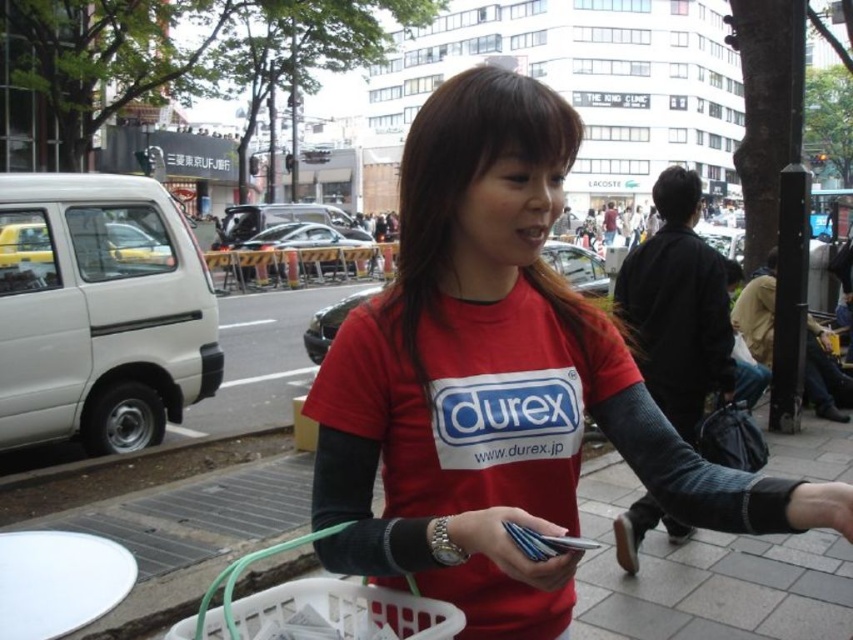
Can you confirm if matte red t-shirt at center is wider than metallic silver cards at center?

Yes.

Can you confirm if matte red t-shirt at center is thinner than metallic silver cards at center?

In fact, matte red t-shirt at center might be wider than metallic silver cards at center.

Which is behind, point (691, 408) or point (480, 547)?

Point (691, 408)

In order to click on matte red t-shirt at center in this screenshot , I will do `click(677, 307)`.

Between point (428, 541) and point (663, 182), which one is positioned in front?

Point (428, 541)

The image size is (853, 640). What do you see at coordinates (498, 376) in the screenshot?
I see `red matte t-shirt at center` at bounding box center [498, 376].

Who is more distant from viewer, (550,323) or (639,536)?

The point (639,536) is more distant.

Locate an element on the screen. The image size is (853, 640). red matte t-shirt at center is located at coordinates (498, 376).

Between white plastic basket at center and matte red t-shirt at center, which one appears on the right side from the viewer's perspective?

matte red t-shirt at center is more to the right.

Looking at this image, which is more to the left, white plastic basket at center or matte red t-shirt at center?

white plastic basket at center

Measure the distance between white plastic basket at center and camera.

white plastic basket at center and camera are 2.75 meters apart.

The width and height of the screenshot is (853, 640). I want to click on white plastic basket at center, so click(705, 577).